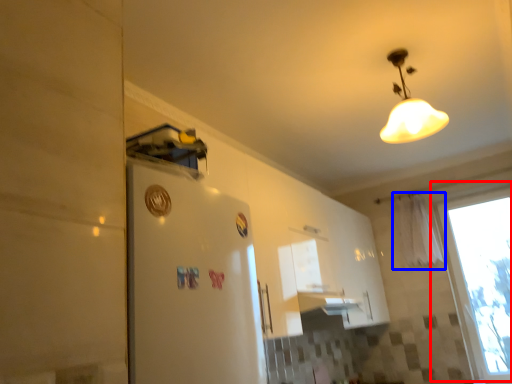
Question: Which object appears farthest to the camera in this image, window (highlighted by a red box) or curtain (highlighted by a blue box)?

Choices:
 (A) window
 (B) curtain

Answer: (B)